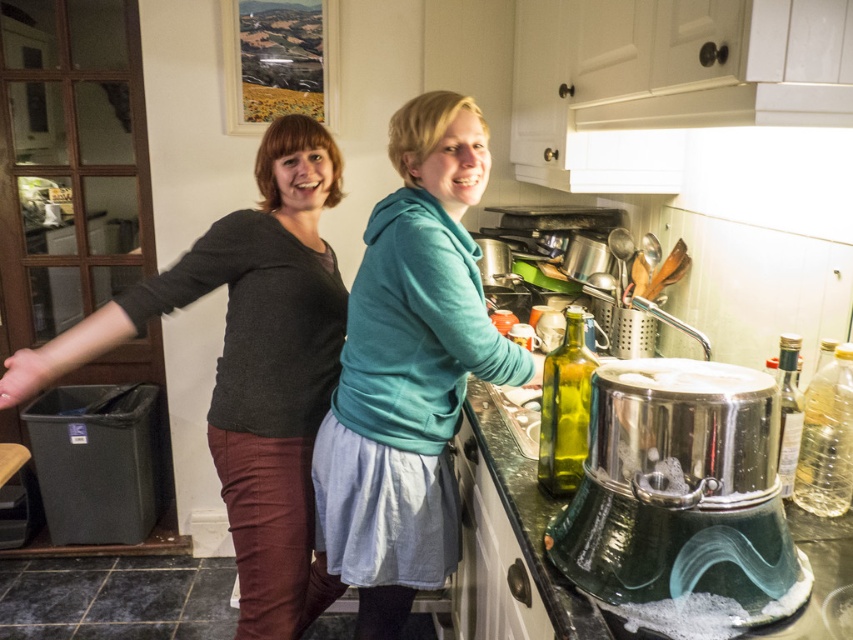
Question: Estimate the real-world distances between objects in this image. Which object is farther from the teal hoodie at center?

Choices:
 (A) matte black sweater at left
 (B) stainless steel pot at lower center

Answer: (B)

Question: Does teal hoodie at center have a larger size compared to matte black sweater at left?

Choices:
 (A) no
 (B) yes

Answer: (A)

Question: Can you confirm if matte black sweater at left is smaller than stainless steel pot at lower center?

Choices:
 (A) yes
 (B) no

Answer: (B)

Question: Which object is farther from the camera taking this photo?

Choices:
 (A) stainless steel pot at lower center
 (B) matte black sweater at left
 (C) teal hoodie at center

Answer: (B)

Question: Does teal hoodie at center appear over stainless steel pot at lower center?

Choices:
 (A) no
 (B) yes

Answer: (B)

Question: Which object is farther from the camera taking this photo?

Choices:
 (A) matte black sweater at left
 (B) teal hoodie at center
 (C) stainless steel pot at lower center

Answer: (A)